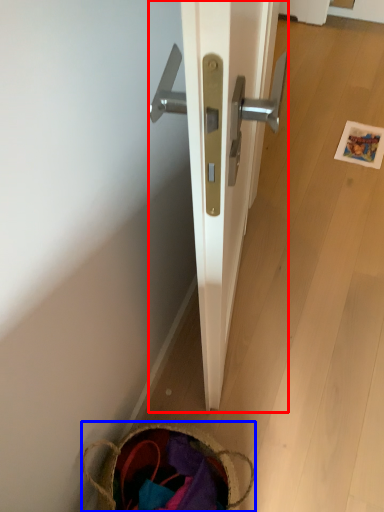
Question: Among these objects, which one is nearest to the camera, door (highlighted by a red box) or basket (highlighted by a blue box)?

Choices:
 (A) door
 (B) basket

Answer: (A)